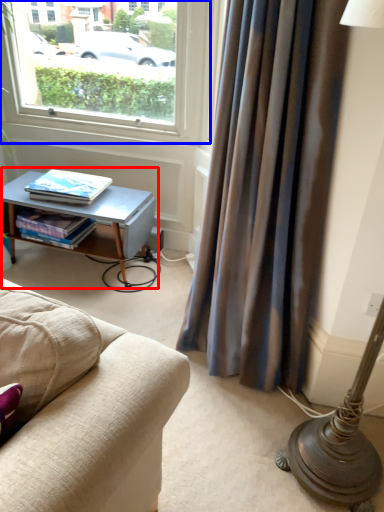
Question: Among these objects, which one is farthest to the camera, table (highlighted by a red box) or window (highlighted by a blue box)?

Choices:
 (A) table
 (B) window

Answer: (A)